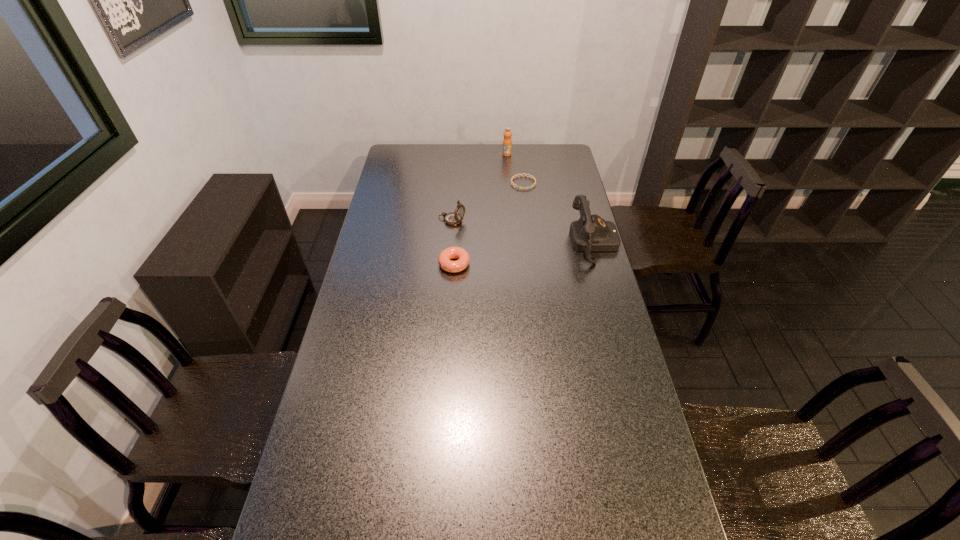
Find the location of a particular element. vacant space at the left edge of the desktop is located at coordinates (371, 273).

Identify the location of blank area at the right edge. (561, 226).

At what (x,y) coordinates should I click in order to perform the action: click on vacant area at the near left corner of the desktop. Please return your answer as a coordinate pair (x, y). Looking at the image, I should click on (346, 514).

The image size is (960, 540). What are the coordinates of `free space at the far right corner of the desktop` in the screenshot? It's located at (546, 151).

Where is `vacant area between the rightmost object and the compass`? The width and height of the screenshot is (960, 540). vacant area between the rightmost object and the compass is located at coordinates (523, 232).

The image size is (960, 540). I want to click on vacant space in between the orange juice and the second shortest object, so click(x=481, y=210).

Identify the location of vacant area between the bracelet and the telephone. The height and width of the screenshot is (540, 960). (559, 213).

Locate an element on the screen. Image resolution: width=960 pixels, height=540 pixels. free space that is in between the rightmost object and the doughnut is located at coordinates (524, 254).

Find the location of a particular element. vacant area that lies between the fourth tallest object and the third shortest object is located at coordinates tap(453, 242).

This screenshot has height=540, width=960. I want to click on vacant space in between the second shortest object and the second farthest object, so click(x=489, y=224).